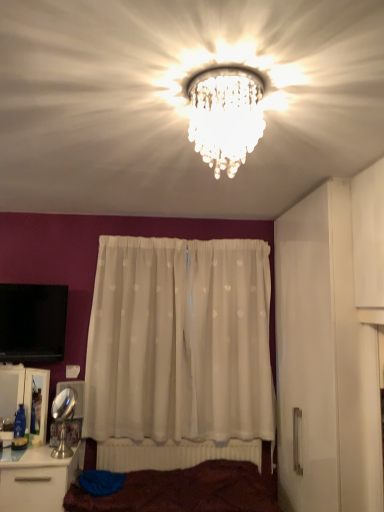
This screenshot has height=512, width=384. I want to click on free spot above clear crystal chandelier at center (from a real-world perspective), so click(224, 78).